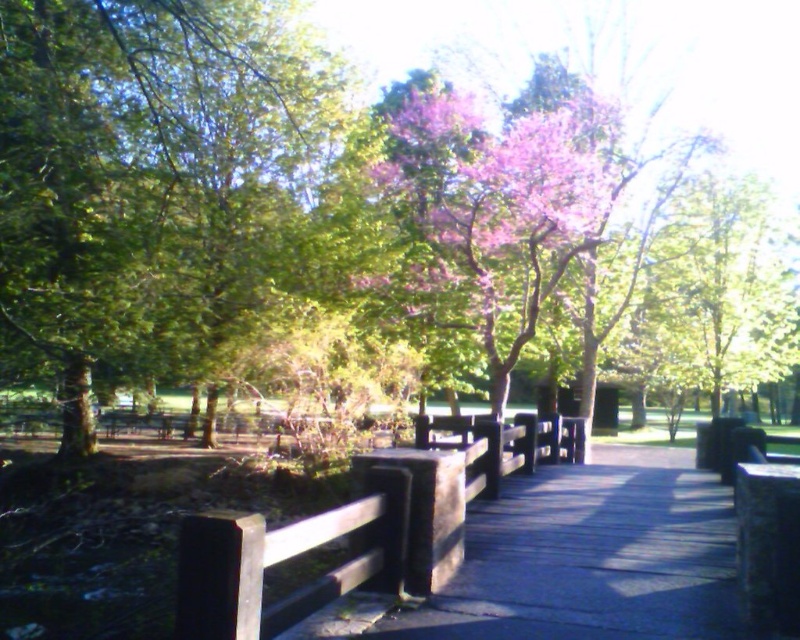
Is wooden bridge at center further to camera compared to pink silky flowers at center?

No, it is in front of pink silky flowers at center.

Which is more to the left, wooden bridge at center or pink silky flowers at center?

pink silky flowers at center is more to the left.

Describe the element at coordinates (578, 561) in the screenshot. I see `wooden bridge at center` at that location.

I want to click on wooden bridge at center, so click(578, 561).

Can you confirm if pink silky flowers at center is taller than brown wood rail at center?

Indeed, pink silky flowers at center has a greater height compared to brown wood rail at center.

Consider the image. Between pink silky flowers at center and brown wood rail at center, which one has more height?

pink silky flowers at center is taller.

This screenshot has height=640, width=800. Describe the element at coordinates (494, 196) in the screenshot. I see `pink silky flowers at center` at that location.

Locate an element on the screen. pink silky flowers at center is located at coordinates (494, 196).

Who is positioned more to the left, wooden bridge at center or brown wood rail at center?

brown wood rail at center is more to the left.

Between wooden bridge at center and brown wood rail at center, which one has more height?

Standing taller between the two is brown wood rail at center.

This screenshot has height=640, width=800. What do you see at coordinates (578, 561) in the screenshot?
I see `wooden bridge at center` at bounding box center [578, 561].

This screenshot has width=800, height=640. What are the coordinates of `wooden bridge at center` in the screenshot? It's located at (578, 561).